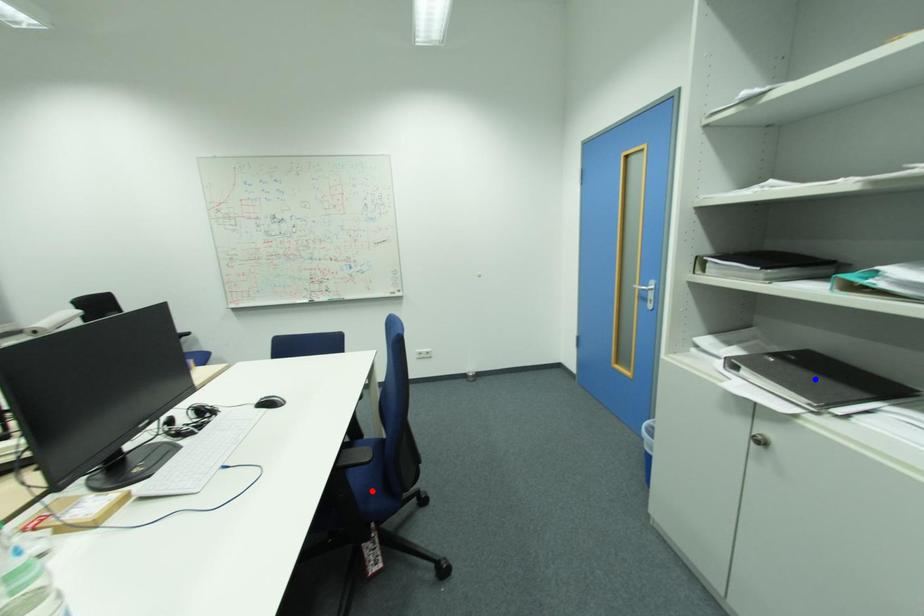
Question: Two points are marked on the image. Which point is closer to the camera?

Choices:
 (A) Blue point is closer.
 (B) Red point is closer.

Answer: (A)